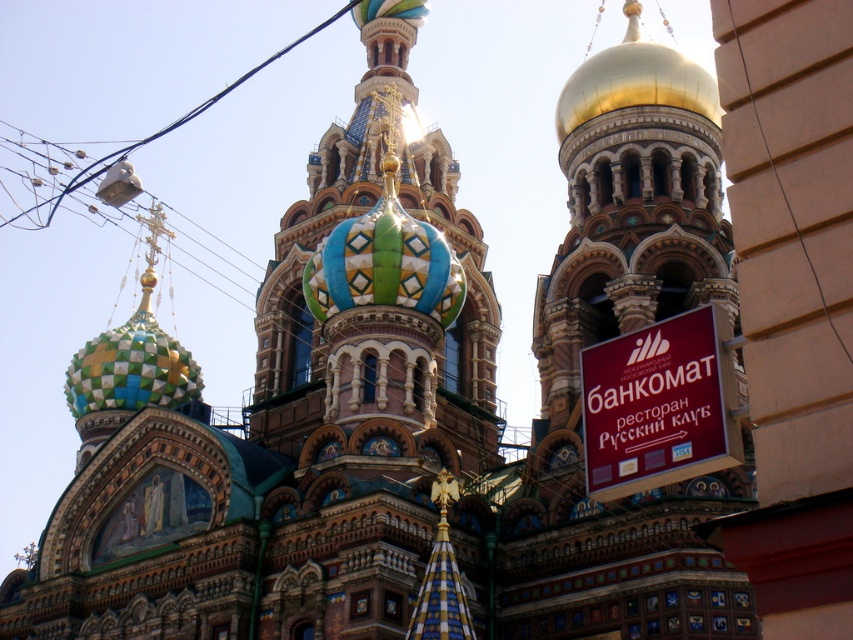
You are an architect examining the building facade and notice the white plastic bag at upper left and the black wire at right. Which object is located more to the left?

The white plastic bag at upper left is more to the left than the black wire at right.

You are standing in front of the grand building and want to take a photo. There are two points marked on your camera screen at coordinates point (251, 72) and point (827, 308). Which point is closer to your camera lens?

Point (251, 72) is further to the camera than point (827, 308), so the point closer to the camera lens is point (827, 308).